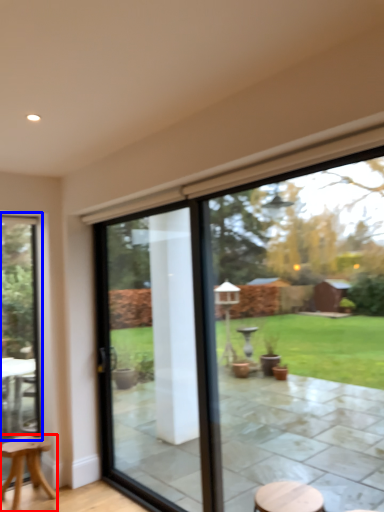
Question: Which point is further to the camera, stool (highlighted by a red box) or window (highlighted by a blue box)?

Choices:
 (A) stool
 (B) window

Answer: (B)